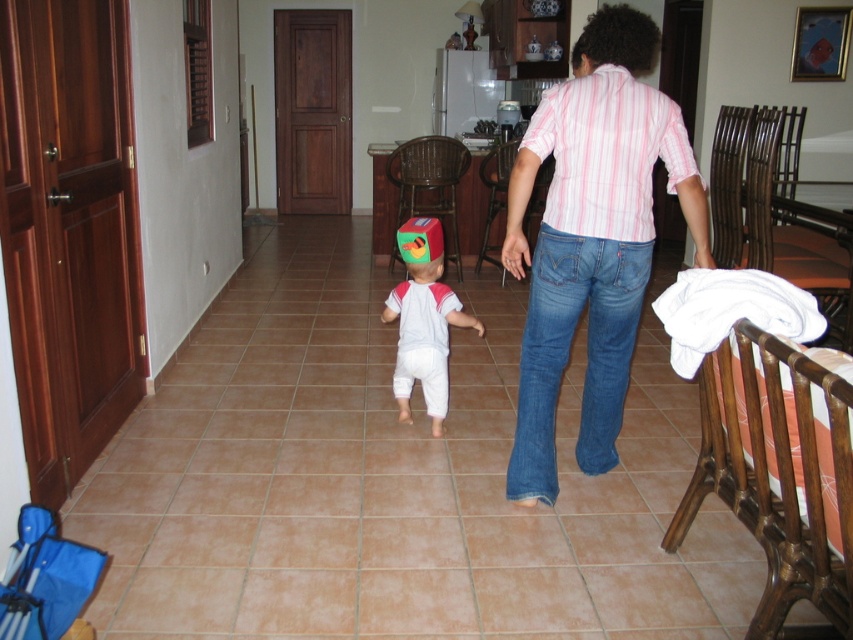
You are standing at the point with coordinates point [421,364] and want to move towards the point with coordinates point [527,244]. Given the layout of the room described in the scene, will you be moving towards the back of the room or the front?

Since point [527,244] is behind point [421,364], moving towards it would mean you are moving towards the back of the room.

You are a photographer setting up a shoot in this room. You need to ensure that the pink striped shirt at center and the white cotton baby at center are both visible in the frame. Which object should you prioritize positioning closer to the camera to maintain their visibility?

The pink striped shirt at center is larger in size than the white cotton baby at center, so you should prioritize positioning the white cotton baby at center closer to the camera to ensure both are visible in the frame.

You are a parent trying to locate your child in a room. You see the pink striped shirt at center and the white cotton baby at center. Which one is higher up?

The pink striped shirt at center is located above the white cotton baby at center, so the pink striped shirt at center is higher up.